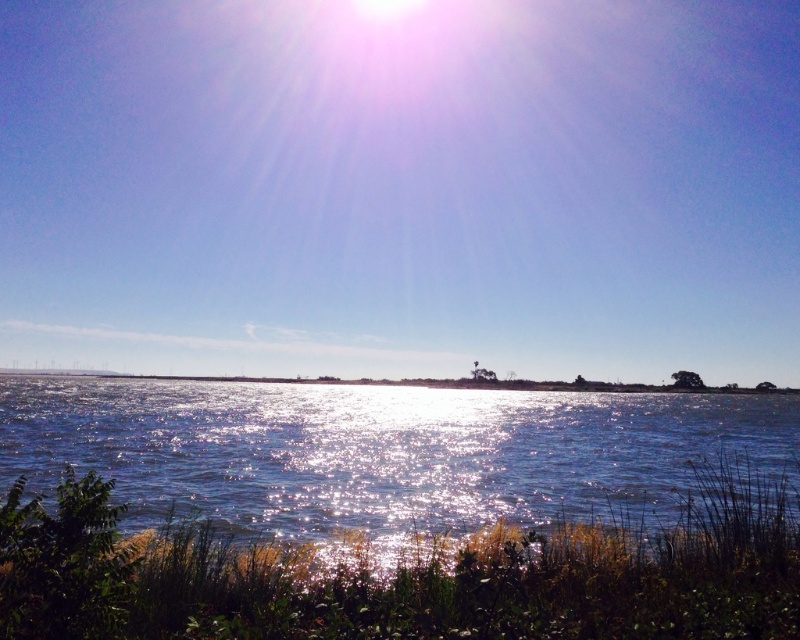
Question: Is bright blue sky at upper center to the right of sparkling blue water at center from the viewer's perspective?

Choices:
 (A) no
 (B) yes

Answer: (A)

Question: Which point appears farthest from the camera in this image?

Choices:
 (A) (238, 506)
 (B) (440, 44)

Answer: (B)

Question: Observing the image, what is the correct spatial positioning of bright blue sky at upper center in reference to sparkling blue water at center?

Choices:
 (A) right
 (B) left

Answer: (B)

Question: Which object appears closest to the camera in this image?

Choices:
 (A) sparkling blue water at center
 (B) bright blue sky at upper center

Answer: (A)

Question: Is bright blue sky at upper center thinner than sparkling blue water at center?

Choices:
 (A) no
 (B) yes

Answer: (A)